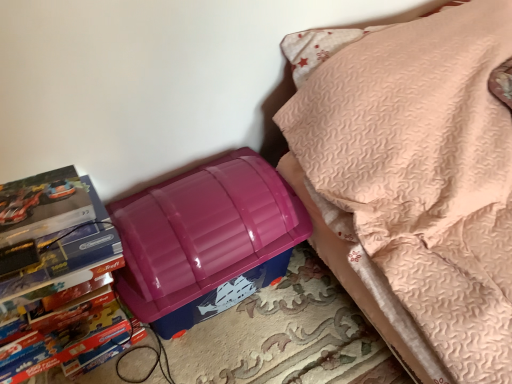
The width and height of the screenshot is (512, 384). In order to click on blank space situated above glossy plastic lunch box at lower left (from a real-world perspective) in this screenshot , I will do `click(193, 203)`.